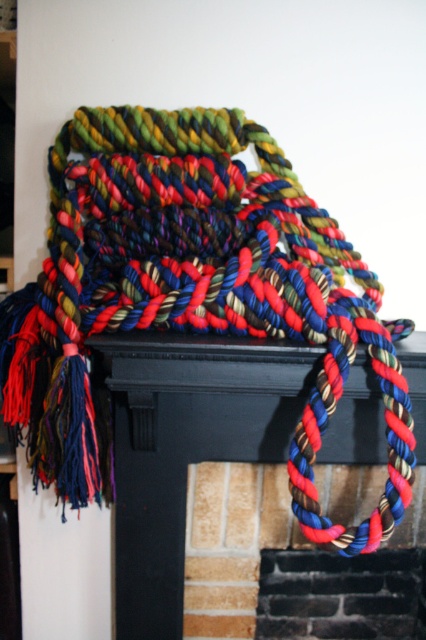
You are an interior designer assessing the placement of decorations on a mantelpiece. You notice two objects labeled as braided multicolored rope at center and multicolored braided rope at center. Which one is positioned closer to the front of the mantelpiece?

The braided multicolored rope at center is closer to the viewer than the multicolored braided rope at center, so the braided multicolored rope at center is positioned closer to the front of the mantelpiece.

You are an interior designer planning to hang a decorative item on the mantelpiece. The existing braided multicolored rope at center is located at coordinates 0.448, 0.455. If you want to place a new item 0.3 units to the right and 0.2 units above the current rope, where would its coordinates be?

The new coordinates would be calculated by adding 0.3 to the x coordinate and 0.2 to the y coordinate of the braided multicolored rope at center. The new position would be at point (x=279, y=477).